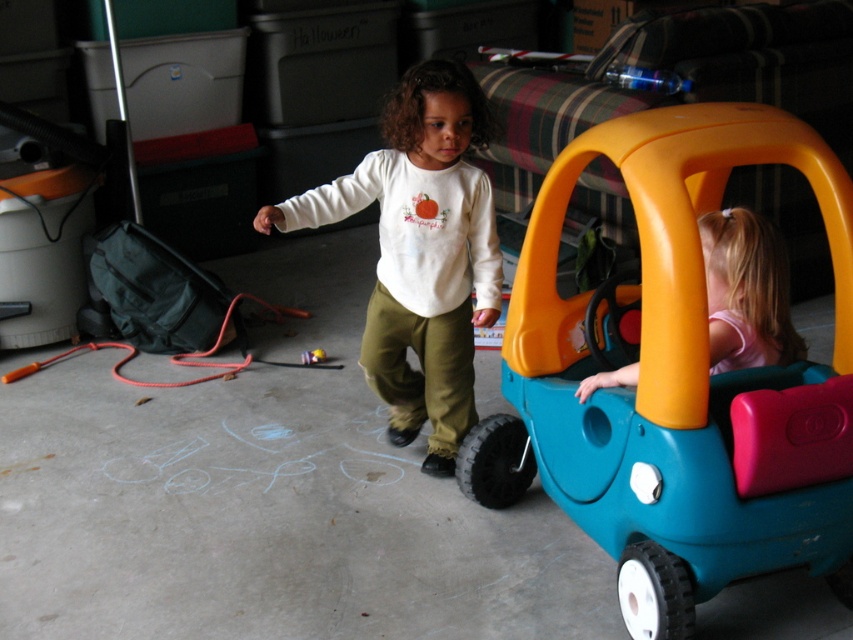
Which is behind, point (747, 225) or point (318, 356)?

Positioned behind is point (318, 356).

Where is `pink matte car seat at right`? Image resolution: width=853 pixels, height=640 pixels. pink matte car seat at right is located at coordinates (746, 292).

This screenshot has height=640, width=853. What do you see at coordinates (746, 292) in the screenshot?
I see `pink matte car seat at right` at bounding box center [746, 292].

Identify the location of pink matte car seat at right. This screenshot has height=640, width=853. (746, 292).

Does white cotton shirt at center have a lesser width compared to pink matte car seat at right?

In fact, white cotton shirt at center might be wider than pink matte car seat at right.

Based on the photo, who is lower down, white cotton shirt at center or pink matte car seat at right?

pink matte car seat at right

This screenshot has height=640, width=853. Find the location of `white cotton shirt at center`. white cotton shirt at center is located at coordinates (421, 253).

Is blue plastic toy car at center above white cotton shirt at center?

Actually, blue plastic toy car at center is below white cotton shirt at center.

Does point (846, 256) come closer to viewer compared to point (460, 138)?

Yes, it is.

Find the location of a particular element. blue plastic toy car at center is located at coordinates (676, 376).